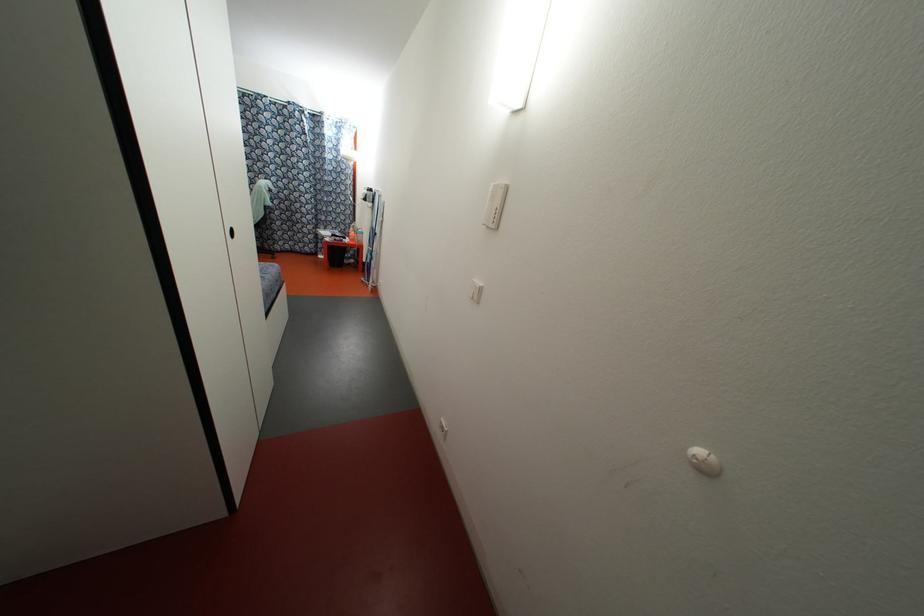
Where would you lift the black trash can? Please return your answer as a coordinate pair (x, y).

(334, 252)